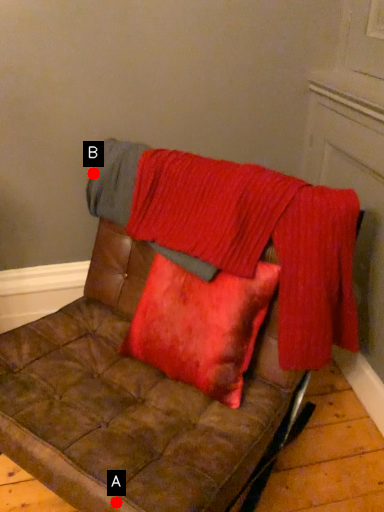
Question: Two points are circled on the image, labeled by A and B beside each circle. Among these points, which one is nearest to the camera?

Choices:
 (A) A is closer
 (B) B is closer

Answer: (A)